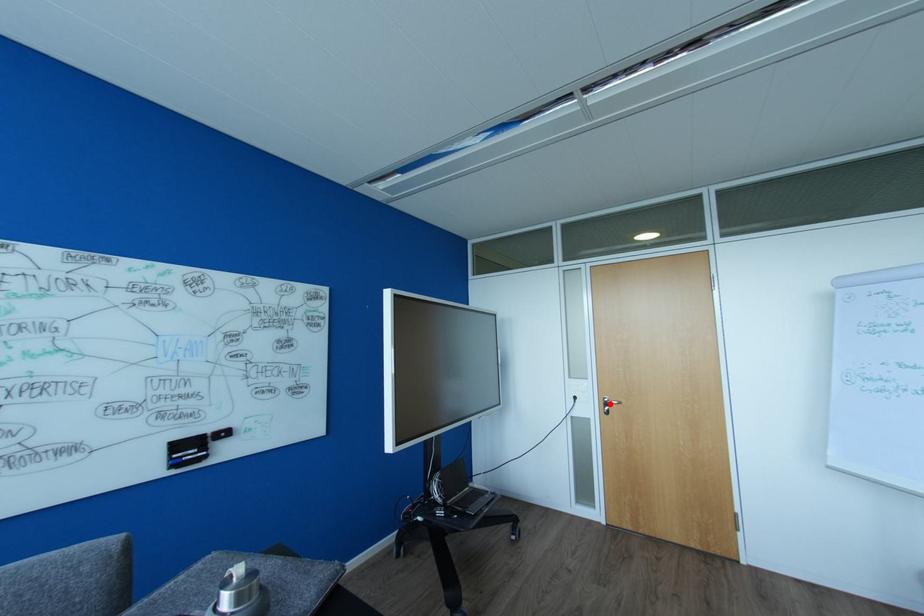
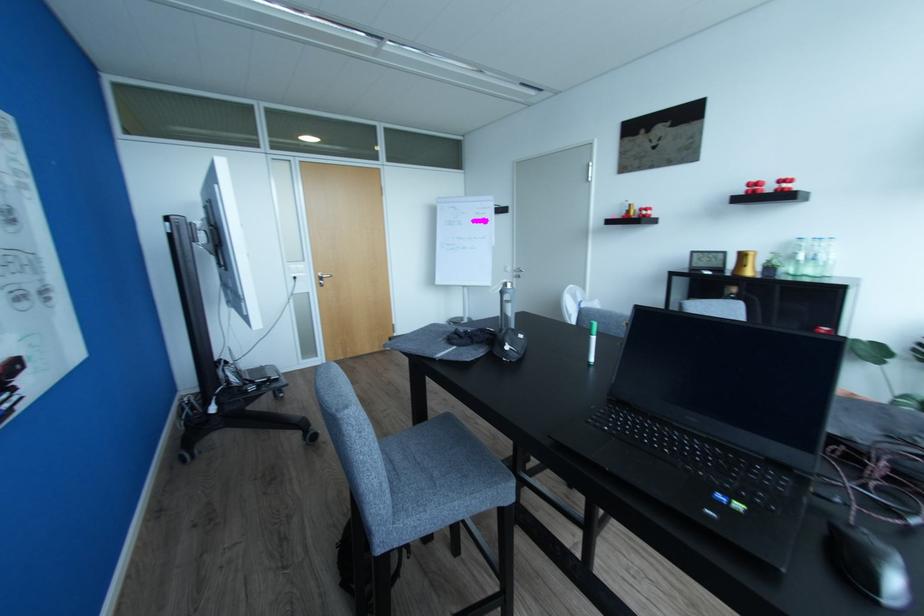
The point at the highlighted location is marked in the first image. Where is the corresponding point in the second image?

(324, 278)